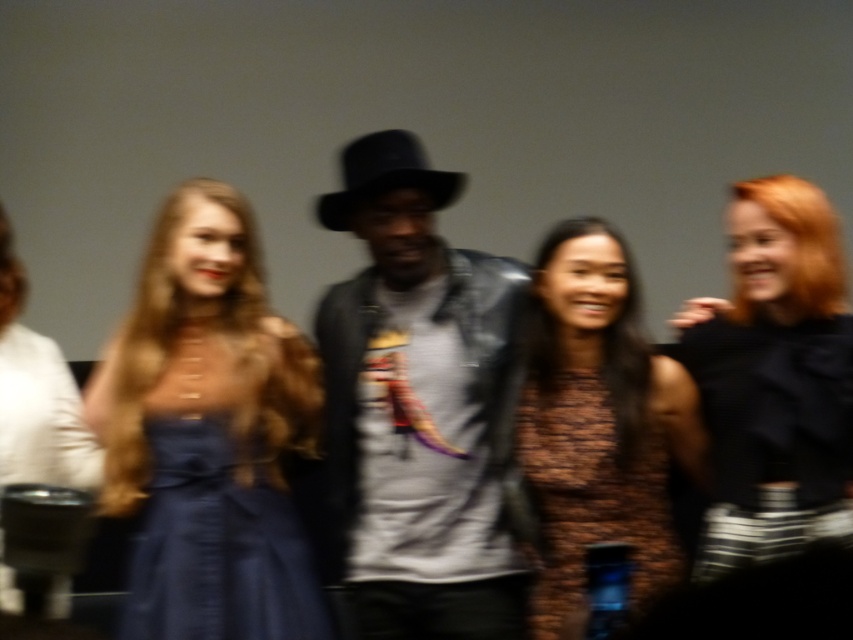
Question: Which point is closer to the camera taking this photo?

Choices:
 (A) (569, 452)
 (B) (401, 362)

Answer: (A)

Question: Is black satin dress at right to the right of brown textured dress at center from the viewer's perspective?

Choices:
 (A) no
 (B) yes

Answer: (B)

Question: Estimate the real-world distances between objects in this image. Which object is closer to the shiny blue dress at left?

Choices:
 (A) matte black dress at left
 (B) matte black cowboy hat at center
 (C) black satin dress at right
 (D) satin blue dress at center

Answer: (D)

Question: In this image, where is black satin dress at right located relative to matte black cowboy hat at center?

Choices:
 (A) above
 (B) below

Answer: (B)

Question: Does shiny blue dress at left lie in front of matte black dress at left?

Choices:
 (A) no
 (B) yes

Answer: (A)

Question: Considering the real-world distances, which object is farthest from the black satin dress at right?

Choices:
 (A) matte black cowboy hat at center
 (B) brown textured dress at center

Answer: (A)